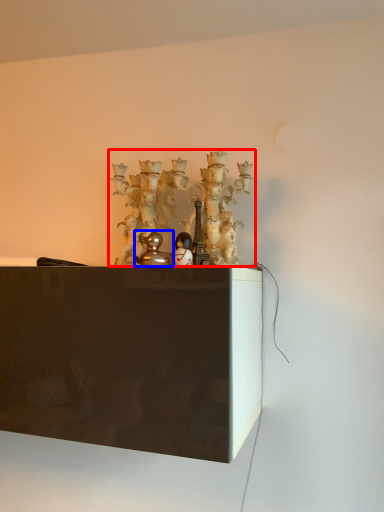
Question: Among these objects, which one is nearest to the camera, art (highlighted by a red box) or toy (highlighted by a blue box)?

Choices:
 (A) art
 (B) toy

Answer: (B)